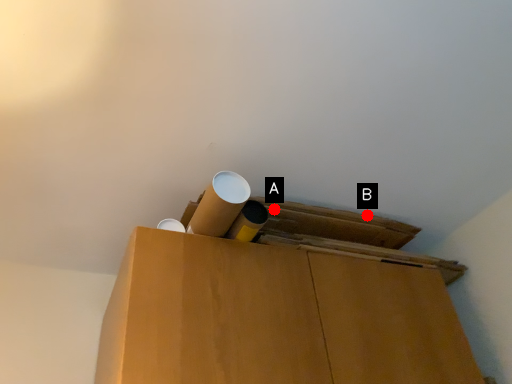
Question: Two points are circled on the image, labeled by A and B beside each circle. Among these points, which one is nearest to the camera?

Choices:
 (A) A is closer
 (B) B is closer

Answer: (A)